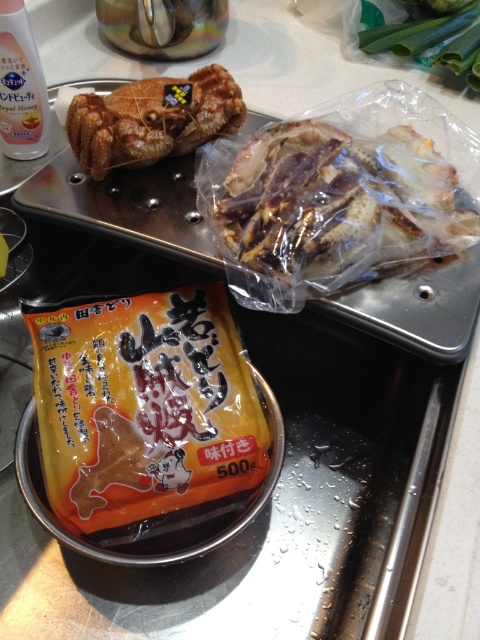
Question: Which object appears farthest from the camera in this image?

Choices:
 (A) translucent plastic chicken at upper right
 (B) orange matte bag at center
 (C) brown crispy crab at upper left

Answer: (C)

Question: Which object appears farthest from the camera in this image?

Choices:
 (A) translucent plastic chicken at upper right
 (B) orange matte bag at center
 (C) brown crispy crab at upper left

Answer: (C)

Question: Where is orange matte bag at center located in relation to translucent plastic chicken at upper right in the image?

Choices:
 (A) above
 (B) below

Answer: (B)

Question: Which of the following is the closest to the observer?

Choices:
 (A) translucent plastic chicken at upper right
 (B) orange matte bag at center

Answer: (B)

Question: Does orange matte bag at center appear over brown crispy crab at upper left?

Choices:
 (A) yes
 (B) no

Answer: (B)

Question: Does orange matte bag at center have a lesser width compared to translucent plastic chicken at upper right?

Choices:
 (A) no
 (B) yes

Answer: (B)